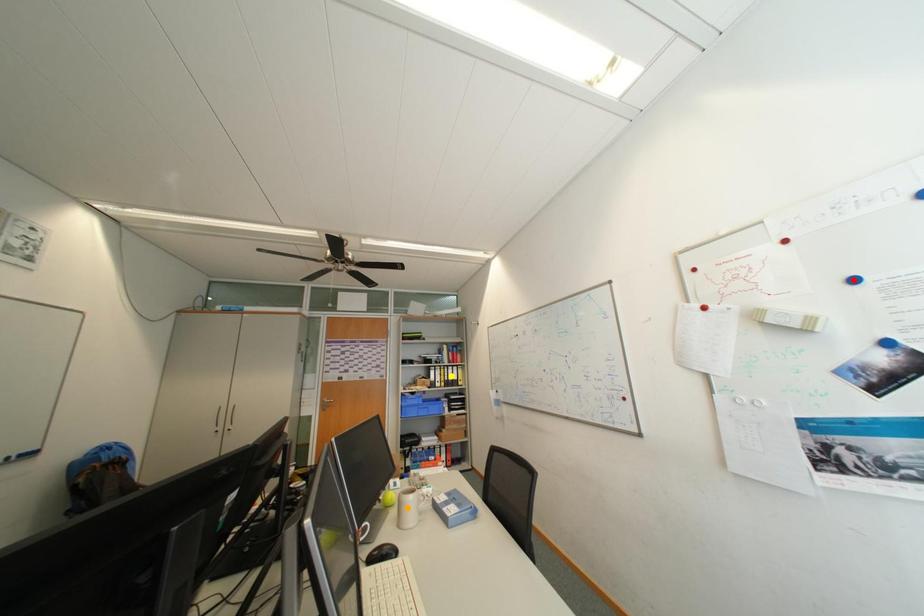
Order these from farthest to nearest:
- orange point
- yellow point
- red point

1. yellow point
2. orange point
3. red point